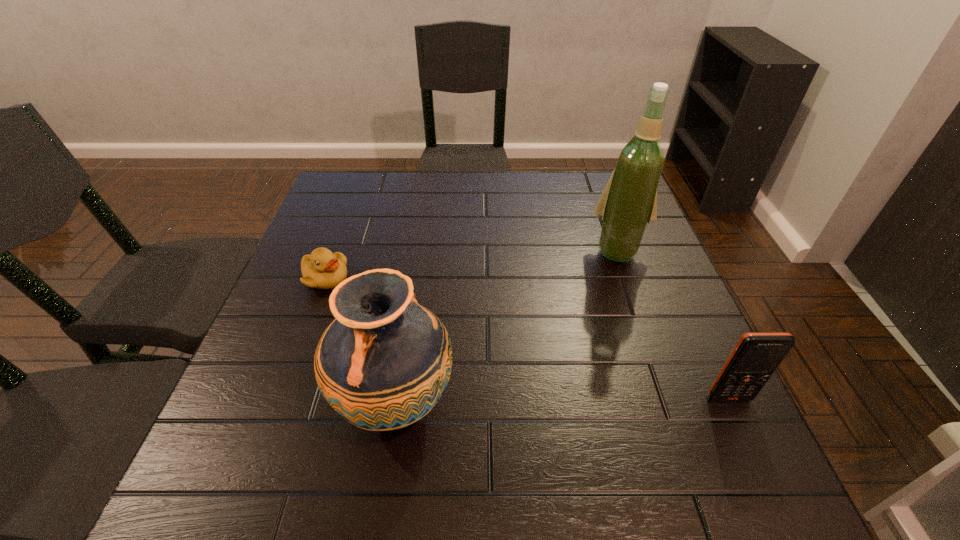
This screenshot has width=960, height=540. Find the location of `vacant space on the desktop that is between the third shortest object and the cellular telephone and is positioned on the front-facing side of the wine bottle`. vacant space on the desktop that is between the third shortest object and the cellular telephone and is positioned on the front-facing side of the wine bottle is located at coordinates (593, 400).

Image resolution: width=960 pixels, height=540 pixels. What are the coordinates of `free spot on the desktop that is between the second object from left to right and the third tallest object and is positioned at the beak of the leftmost object` in the screenshot? It's located at (537, 400).